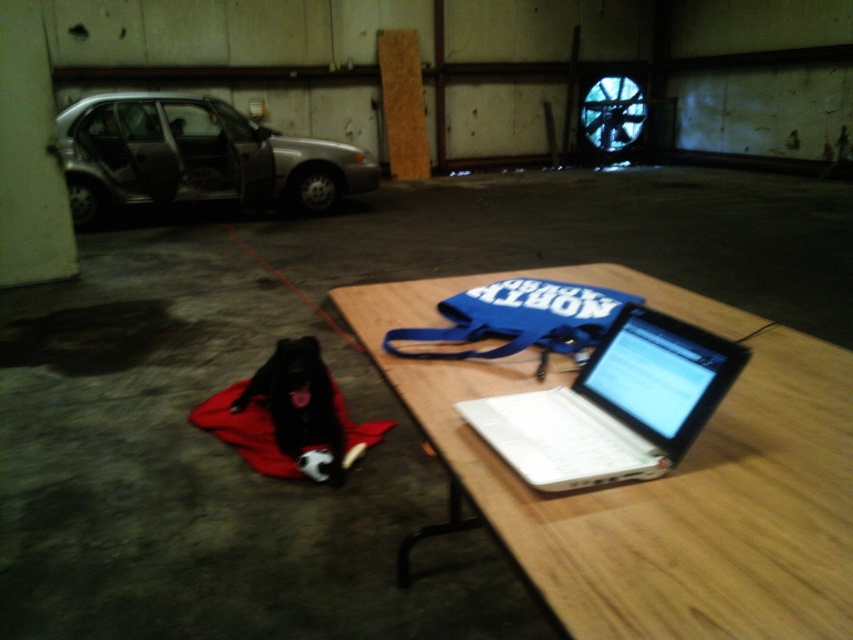
Does silver metallic car at left have a lesser width compared to black fur dog at lower left?

In fact, silver metallic car at left might be wider than black fur dog at lower left.

What do you see at coordinates (195, 156) in the screenshot? I see `silver metallic car at left` at bounding box center [195, 156].

The height and width of the screenshot is (640, 853). I want to click on silver metallic car at left, so click(x=195, y=156).

Can you confirm if wooden table at center is positioned to the left of white plastic laptop at center?

No, wooden table at center is not to the left of white plastic laptop at center.

The width and height of the screenshot is (853, 640). I want to click on wooden table at center, so click(x=654, y=480).

Where is `wooden table at center`? The width and height of the screenshot is (853, 640). wooden table at center is located at coordinates (654, 480).

Based on the photo, between wooden table at center and silver metallic car at left, which one is positioned higher?

silver metallic car at left is above.

Describe the element at coordinates (654, 480) in the screenshot. The width and height of the screenshot is (853, 640). I see `wooden table at center` at that location.

Locate an element on the screen. The image size is (853, 640). wooden table at center is located at coordinates (654, 480).